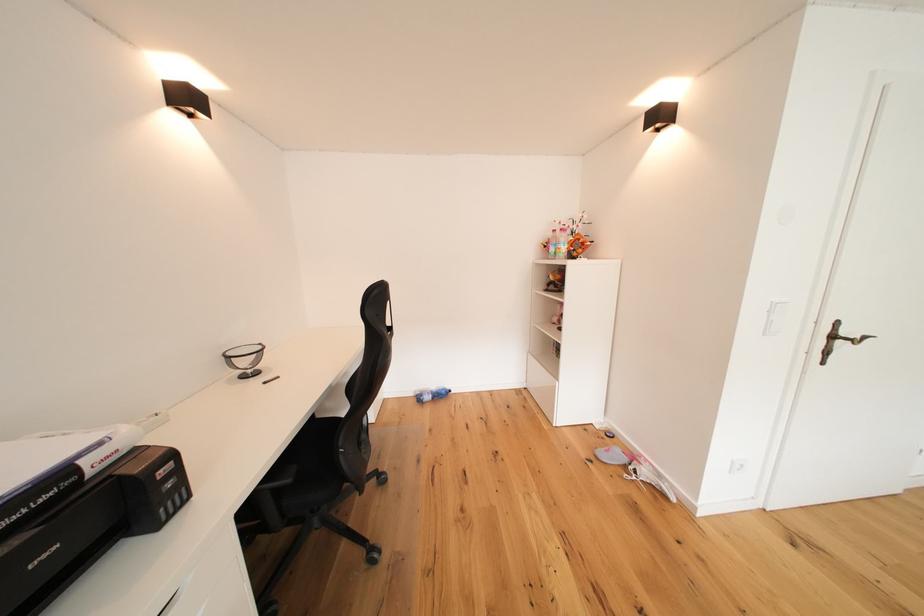
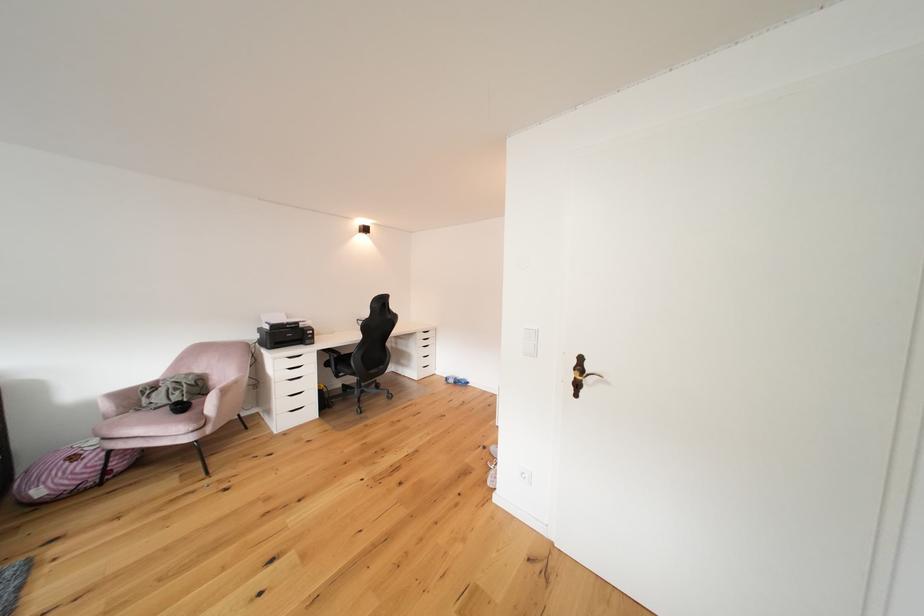
Question: I am providing you with two images of the same scene from different viewpoints. After the viewpoint changes to image2, which objects are now occluded?

Choices:
 (A) pink chair armrest
 (B) black chair sitting surface
 (C) pink-labeled bottle
 (D) grey bottle cap

Answer: (C)